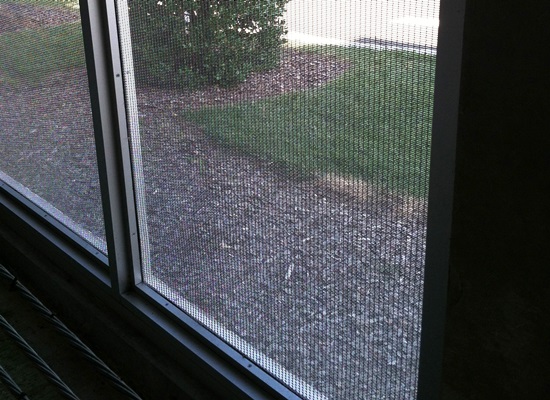
Find the location of a particular element. The image size is (550, 400). one black colored wall under the windows is located at coordinates (161, 374).